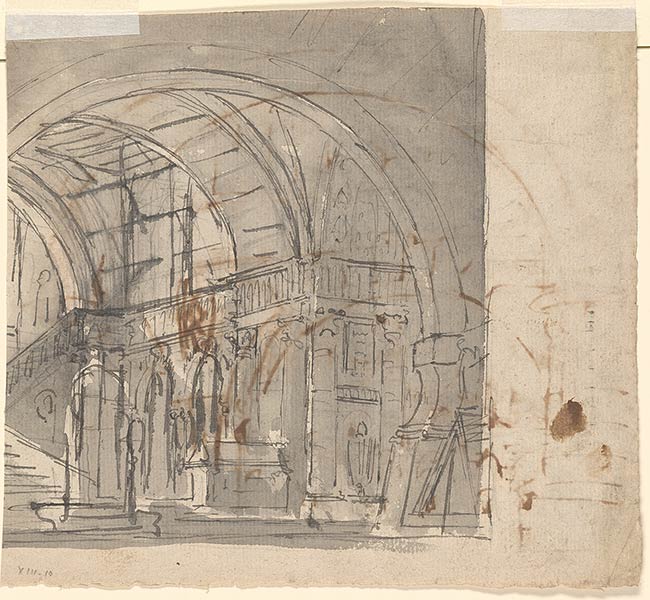
You are a GUI agent. You are given a task and a screenshot of the screen. Output one action in this format:
    pyautogui.click(x=<x>, y=<y>)
    Task: Click on the stairs
    
    Given the screenshot: What is the action you would take?
    pyautogui.click(x=28, y=477)